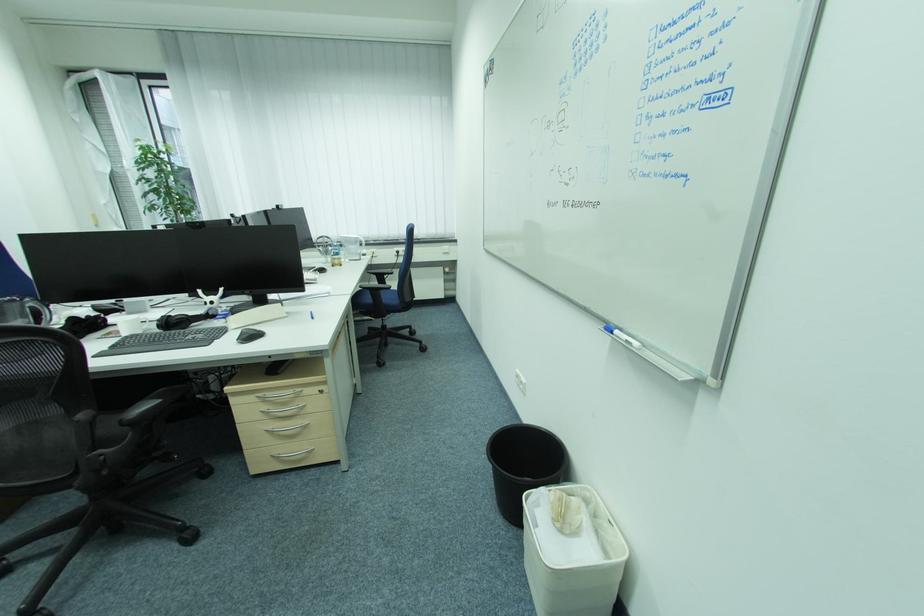
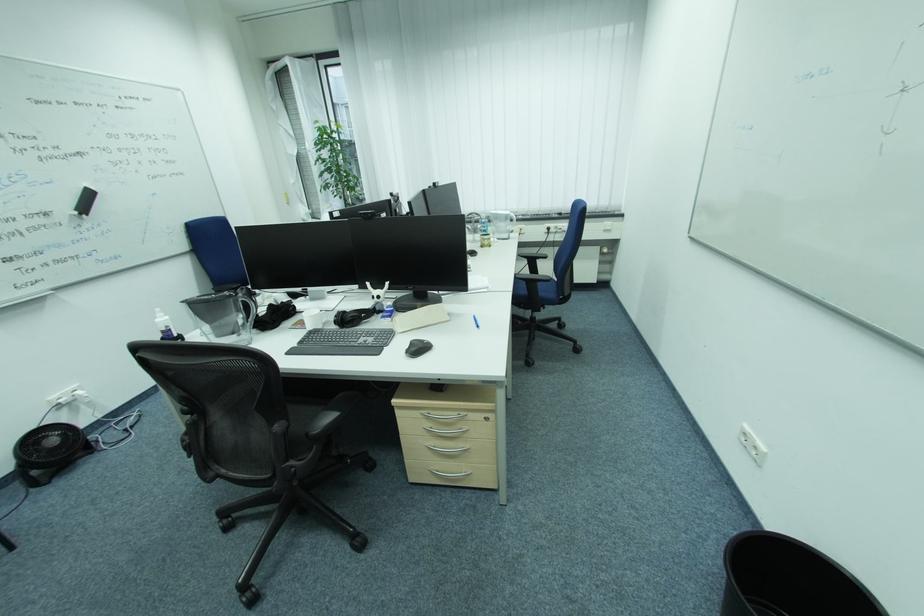
Where in the second image is the point corresponding to point 251,338 from the first image?

(419, 350)